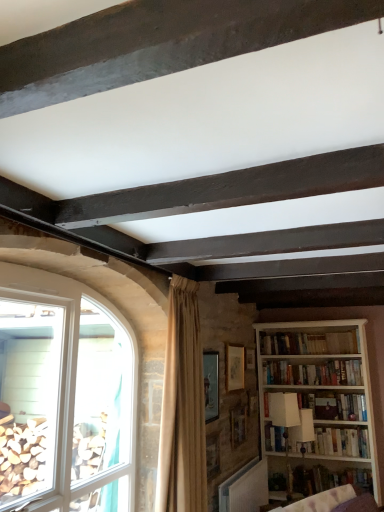
Question: Considering the relative positions of wooden picture frame at center, acting as the third picture frame starting from the back, and white wooden bookshelf at center, which is the 2th book in top-to-bottom order, in the image provided, is wooden picture frame at center, acting as the third picture frame starting from the back, to the left or to the right of white wooden bookshelf at center, which is the 2th book in top-to-bottom order,?

Choices:
 (A) left
 (B) right

Answer: (A)

Question: Considering the positions of wooden picture frame at center, the second picture frame from the front, and white wooden bookshelf at center, which is counted as the third book, starting from the bottom, in the image, is wooden picture frame at center, the second picture frame from the front, taller or shorter than white wooden bookshelf at center, which is counted as the third book, starting from the bottom,?

Choices:
 (A) short
 (B) tall

Answer: (B)

Question: Which object is the farthest from the wooden picture frame at center, which ranks as the 1th picture frame in front-to-back order?

Choices:
 (A) beige fabric curtain at center
 (B) wooden picture frame at center, arranged as the 2th picture frame when viewed from the back
 (C) white wooden bookcase at right
 (D) clear glass window at lower left
 (E) wooden bookshelf at lower right, which is the fourth book from top to bottom

Answer: (C)

Question: Based on their relative distances, which object is nearer to the white wooden bookshelf at center, which is counted as the third book, starting from the bottom?

Choices:
 (A) white matte bookshelf at right, which is the 4th book from bottom to top
 (B) clear glass window at lower left
 (C) white paperback book at right, the 2th book ordered from the bottom
 (D) beige fabric curtain at center
 (E) wooden bookshelf at lower right, the first book positioned from the bottom

Answer: (A)